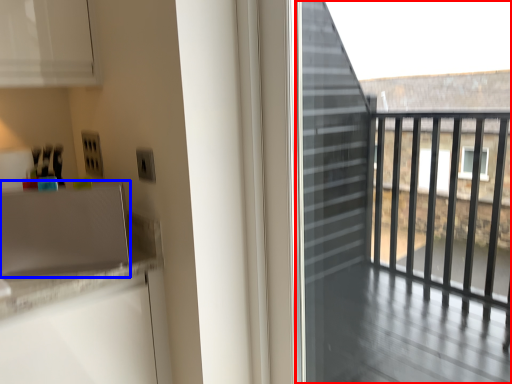
Question: Among these objects, which one is farthest to the camera, screen door (highlighted by a red box) or appliance (highlighted by a blue box)?

Choices:
 (A) screen door
 (B) appliance

Answer: (B)